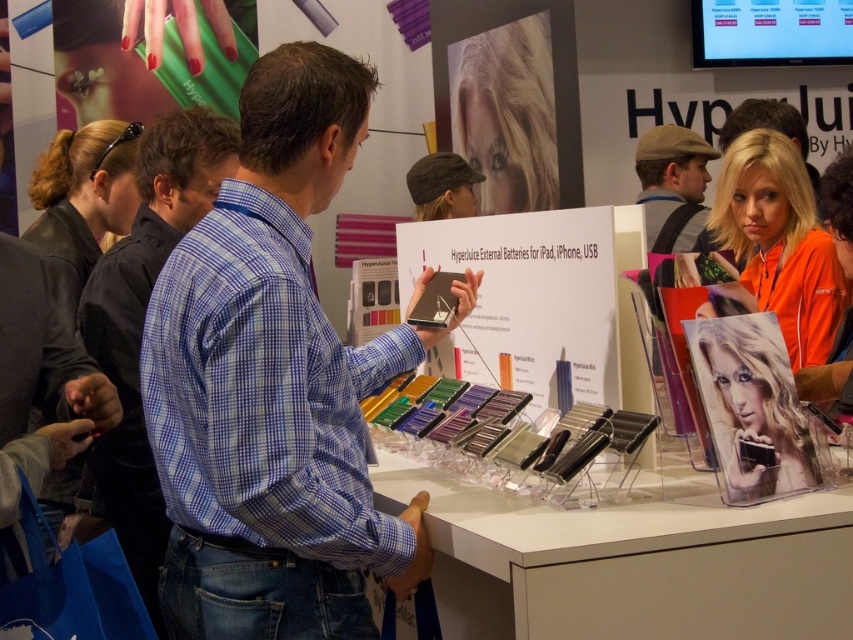
Does brown leather jacket at upper left have a greater width compared to khaki wool cap at upper right?

Yes, brown leather jacket at upper left is wider than khaki wool cap at upper right.

Is brown leather jacket at upper left bigger than khaki wool cap at upper right?

Correct, brown leather jacket at upper left is larger in size than khaki wool cap at upper right.

Identify the location of brown leather jacket at upper left. The height and width of the screenshot is (640, 853). (82, 202).

Does blue plaid shirt at center lie in front of blonde hair at upper right?

Yes, blue plaid shirt at center is closer to the viewer.

Based on the photo, does blue plaid shirt at center appear under blonde hair at upper right?

Yes.

The image size is (853, 640). Find the location of `blue plaid shirt at center`. blue plaid shirt at center is located at coordinates (143, 321).

Image resolution: width=853 pixels, height=640 pixels. I want to click on blue plaid shirt at center, so click(143, 321).

Can you confirm if blue plaid shirt at center is positioned below blonde hair at center?

Actually, blue plaid shirt at center is above blonde hair at center.

Who is more distant from viewer, (134, 477) or (744, 321)?

Point (134, 477)

Where is `blue plaid shirt at center`? blue plaid shirt at center is located at coordinates (143, 321).